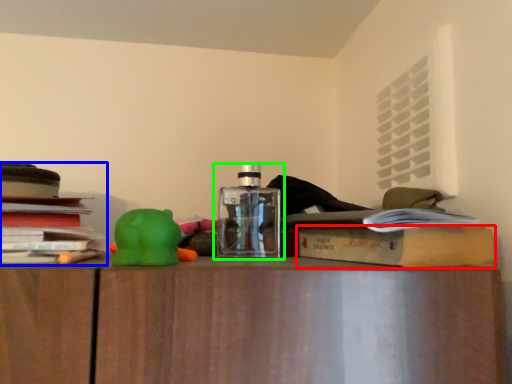
Question: Which is farther away from paperback book (highlighted by a red box)? book (highlighted by a blue box) or bottle (highlighted by a green box)?

Choices:
 (A) book
 (B) bottle

Answer: (A)